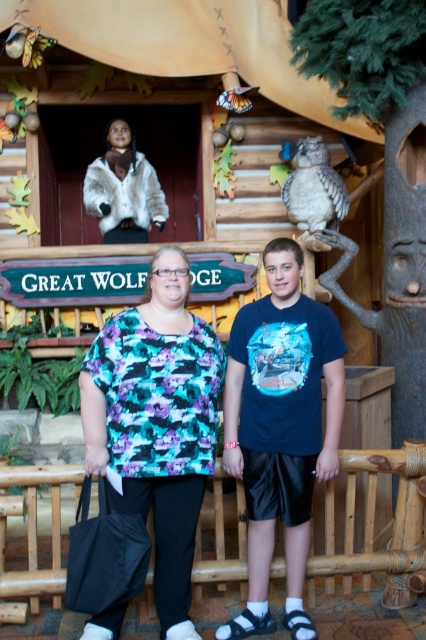
Looking at this image, is navy blue t-shirt at center taller than gray feathered owl at upper right?

Yes.

Which is behind, point (287, 512) or point (322, 145)?

The point (322, 145) is more distant.

In order to click on navy blue t-shirt at center in this screenshot , I will do [281, 428].

In the scene shown: Can you confirm if printed fabric blouse at center is wider than gray feathered owl at upper right?

Yes.

Can you confirm if printed fabric blouse at center is positioned above gray feathered owl at upper right?

No, printed fabric blouse at center is not above gray feathered owl at upper right.

Describe the element at coordinates (157, 422) in the screenshot. The width and height of the screenshot is (426, 640). I see `printed fabric blouse at center` at that location.

Identify the location of printed fabric blouse at center. (157, 422).

Which is more to the left, printed fabric blouse at center or navy blue t-shirt at center?

Positioned to the left is printed fabric blouse at center.

Can you confirm if printed fabric blouse at center is positioned to the right of navy blue t-shirt at center?

Incorrect, printed fabric blouse at center is not on the right side of navy blue t-shirt at center.

Describe the element at coordinates (157, 422) in the screenshot. This screenshot has height=640, width=426. I see `printed fabric blouse at center` at that location.

Where is `printed fabric blouse at center`? printed fabric blouse at center is located at coordinates (157, 422).